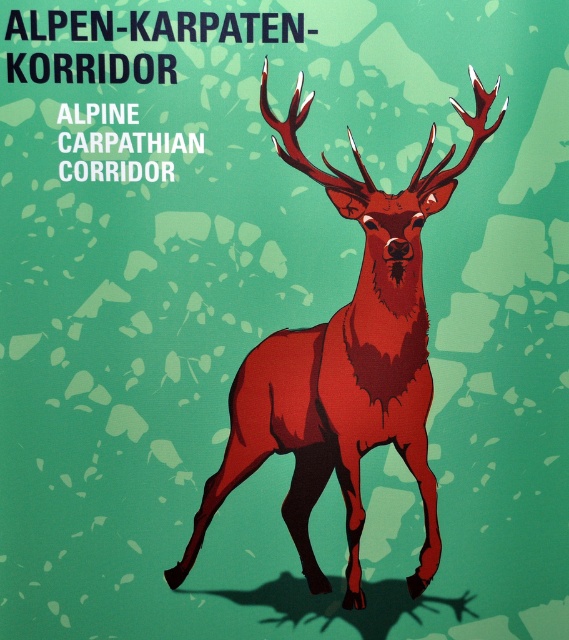
What is the spatial relationship between the matte red deer at center and the shiny red antlers at center?

The matte red deer at center is positioned on the left side of the shiny red antlers at center.

What is the position of the matte red deer at center relative to the shiny red antlers at center?

The matte red deer at center is located below the shiny red antlers at center.

What is the relationship between the size of the matte red deer at center and the shiny red antlers at center in terms of their widths?

The matte red deer at center is wider than the shiny red antlers at center, as the deer has a larger width than its antlers according to the description.